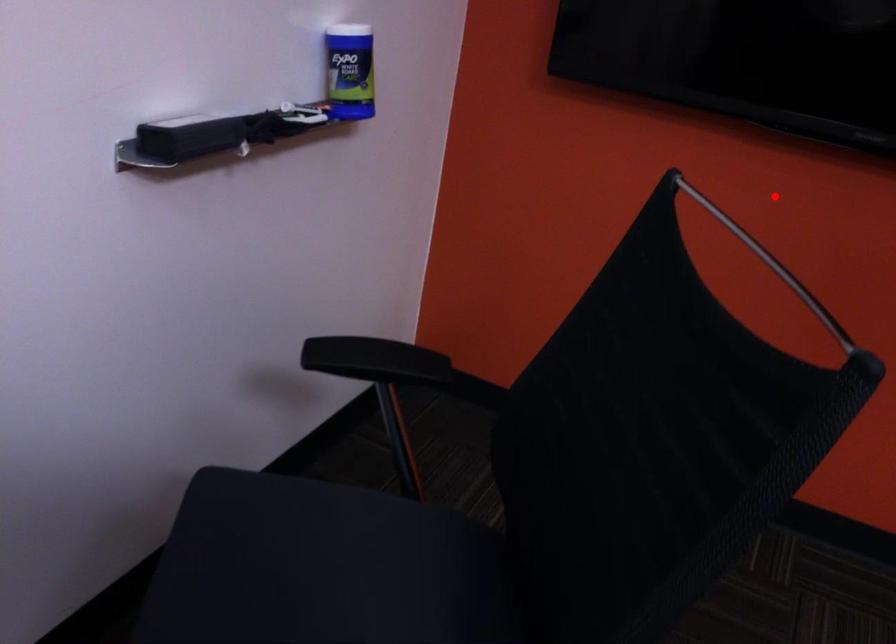
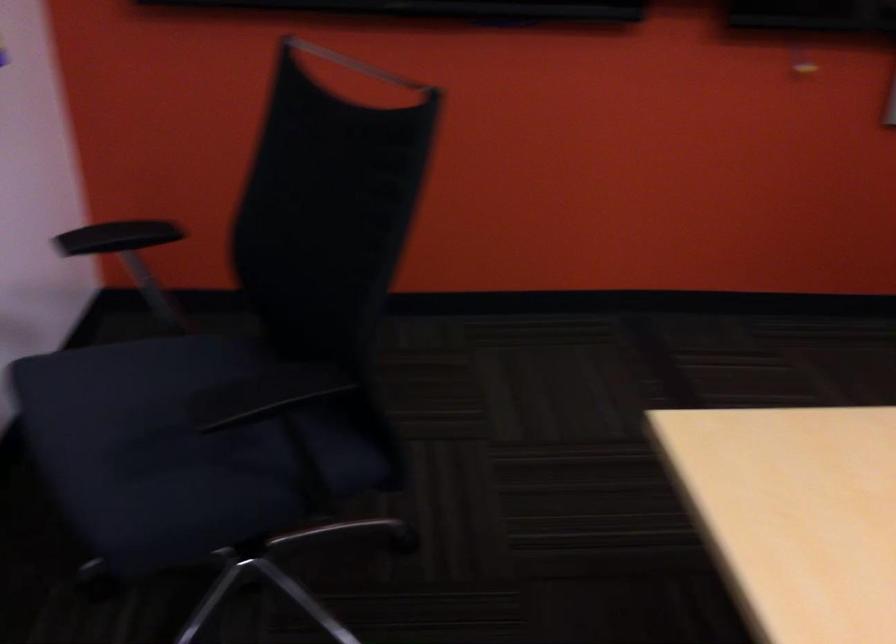
Where in the second image is the point corresponding to the highlighted location from the first image?

(356, 64)